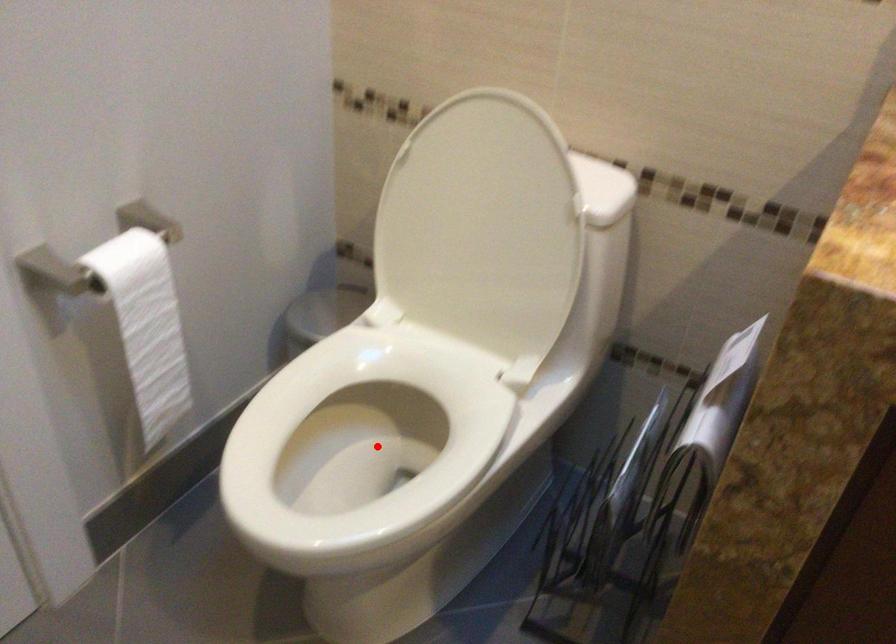
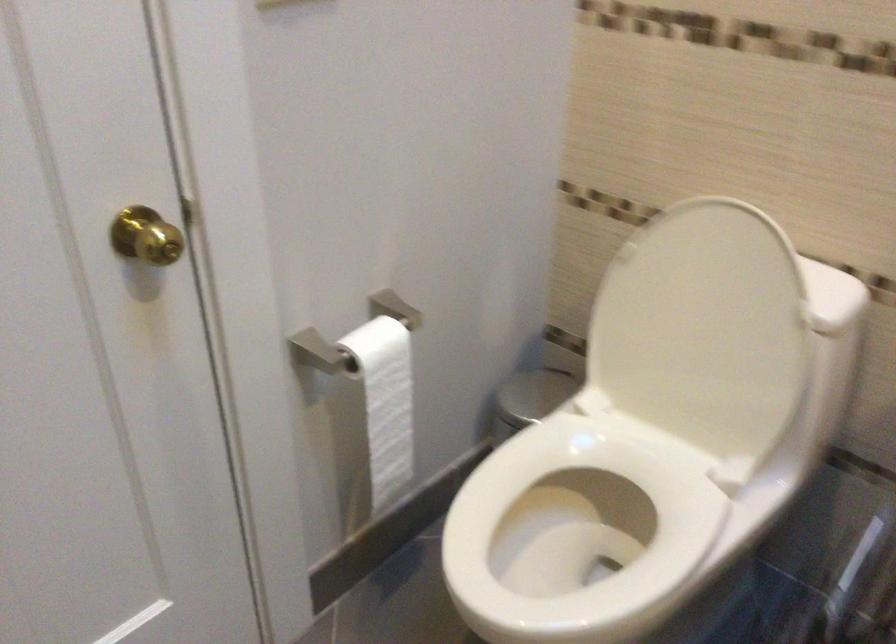
The point at the highlighted location is marked in the first image. Where is the corresponding point in the second image?

(581, 531)